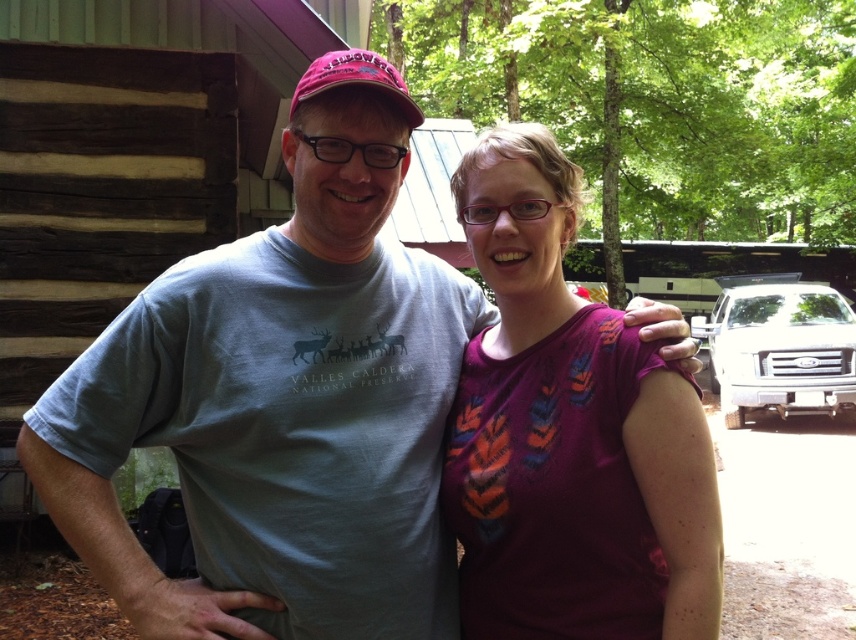
Question: Is light blue cotton t-shirt at center to the left of purple printed shirt at center from the viewer's perspective?

Choices:
 (A) yes
 (B) no

Answer: (A)

Question: Is light blue cotton t-shirt at center to the left of purple printed shirt at center from the viewer's perspective?

Choices:
 (A) no
 (B) yes

Answer: (B)

Question: Does light blue cotton t-shirt at center come behind purple printed shirt at center?

Choices:
 (A) yes
 (B) no

Answer: (A)

Question: Which object is farther from the camera taking this photo?

Choices:
 (A) light blue cotton t-shirt at center
 (B) purple printed shirt at center

Answer: (A)

Question: Which point appears closest to the camera in this image?

Choices:
 (A) (277, 323)
 (B) (557, 372)

Answer: (A)